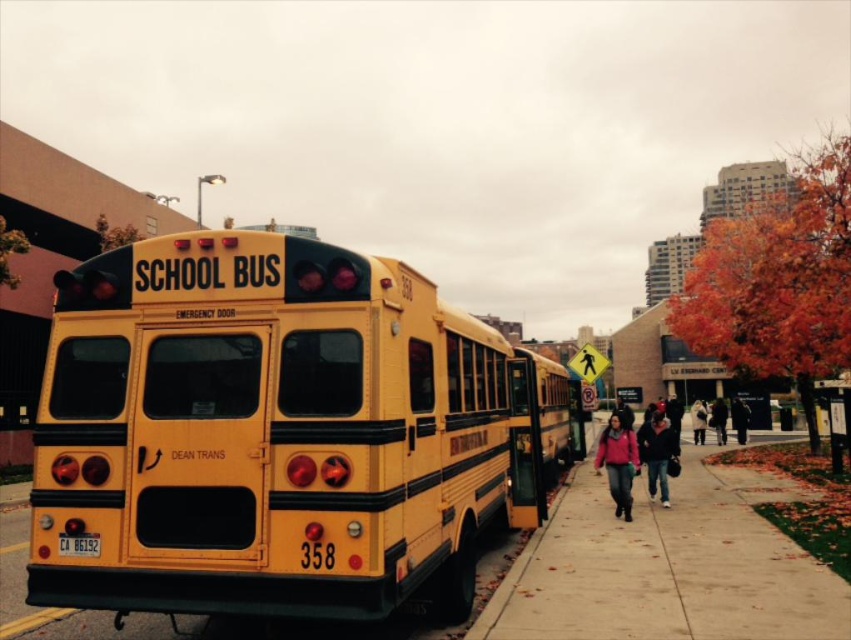
Looking at this image, between white fluffy coat at center and matte black jacket at center, which one appears on the left side from the viewer's perspective?

matte black jacket at center

Is white fluffy coat at center to the right of matte black jacket at center from the viewer's perspective?

Yes, white fluffy coat at center is to the right of matte black jacket at center.

Locate an element on the screen. This screenshot has width=851, height=640. white fluffy coat at center is located at coordinates (698, 420).

The height and width of the screenshot is (640, 851). Identify the location of white fluffy coat at center. (698, 420).

Does dark blue jacket at center have a lesser height compared to matte black jacket at center?

Indeed, dark blue jacket at center has a lesser height compared to matte black jacket at center.

The image size is (851, 640). What do you see at coordinates (718, 419) in the screenshot?
I see `dark blue jacket at center` at bounding box center [718, 419].

Is point (720, 432) positioned before point (625, 410)?

No, (720, 432) is behind (625, 410).

Where is `dark blue jacket at center`? The width and height of the screenshot is (851, 640). dark blue jacket at center is located at coordinates (718, 419).

This screenshot has width=851, height=640. In order to click on dark blue jeans at lower right in this screenshot , I will do `click(740, 419)`.

Is point (734, 422) closer to viewer compared to point (712, 410)?

That is True.

Locate an element on the screen. This screenshot has height=640, width=851. dark blue jeans at lower right is located at coordinates (740, 419).